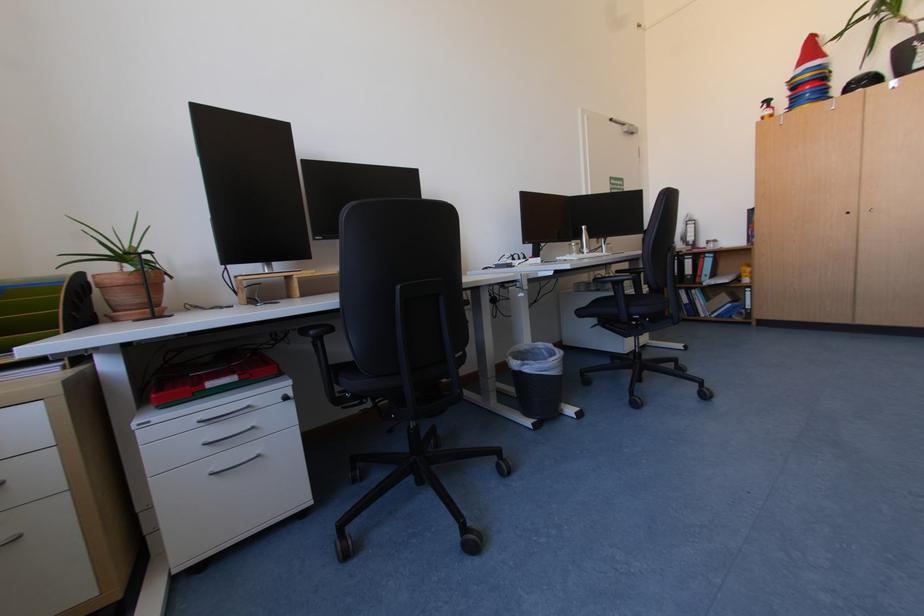
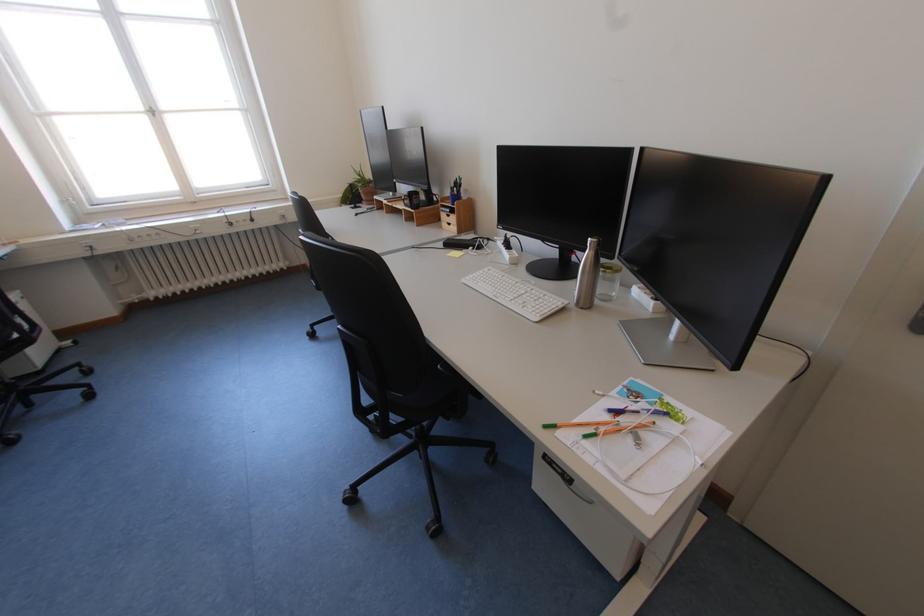
Find the pixel in the second image that matches point 591,228 in the first image.

(599, 240)